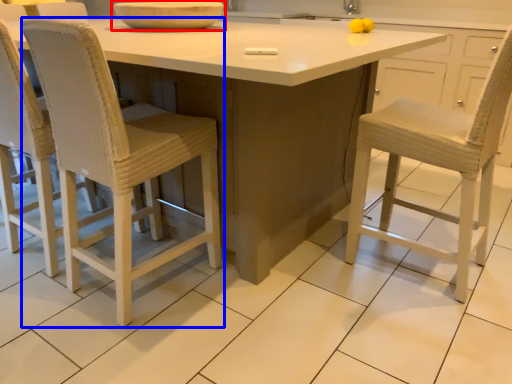
Question: Among these objects, which one is nearest to the camera, bowl (highlighted by a red box) or chair (highlighted by a blue box)?

Choices:
 (A) bowl
 (B) chair

Answer: (B)